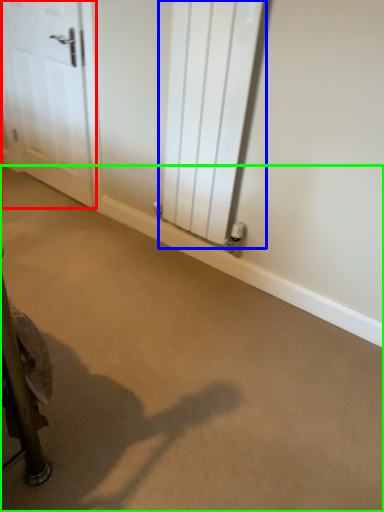
Question: Which object is the closest to the door (highlighted by a red box)? Choose among these: radiator (highlighted by a blue box) or concrete (highlighted by a green box).

Choices:
 (A) radiator
 (B) concrete

Answer: (A)